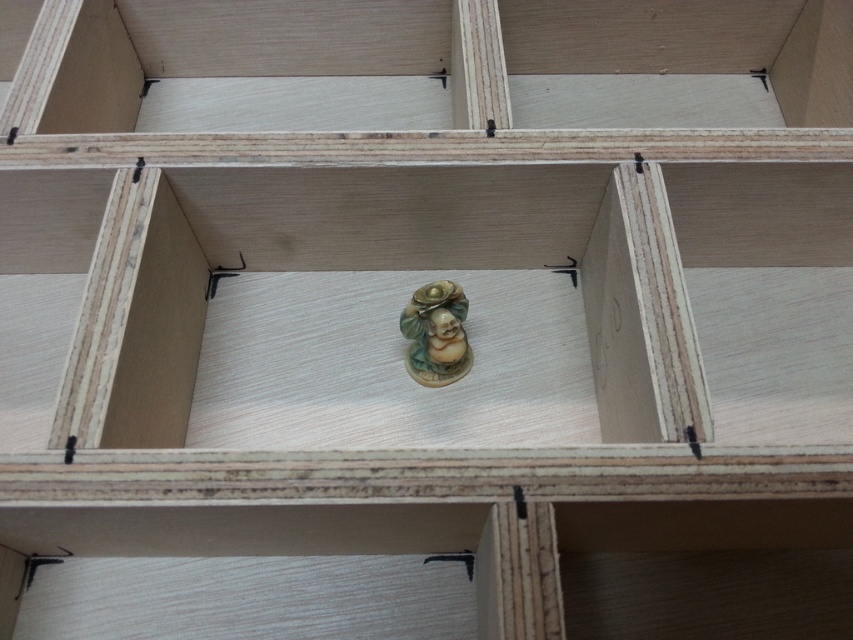
Between matte ceramic statue at center and matte ceramic figurine at center, which one is positioned higher?

matte ceramic statue at center

Is matte ceramic statue at center below matte ceramic figurine at center?

Incorrect, matte ceramic statue at center is not positioned below matte ceramic figurine at center.

Which is behind, point (326, 244) or point (428, 321)?

Point (326, 244)

Identify the location of matte ceramic statue at center. (404, 307).